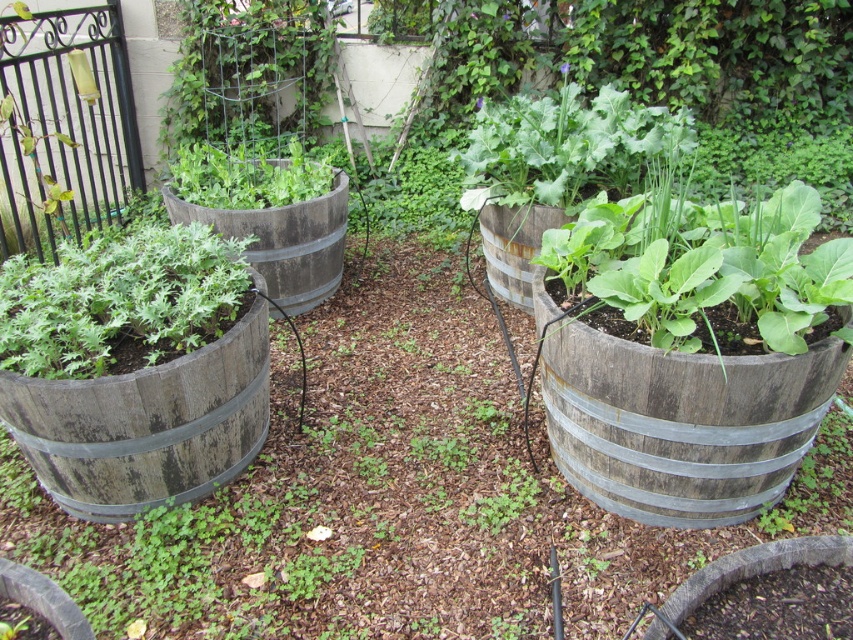
You are standing in the garden and want to take a closeup photo of the green matte barrel at left. Your camera requires you to be at least 2 meters away to avoid distortion. Can you take the photo without moving closer than the required distance?

The distance between the green matte barrel at left and the camera is 1.93 meters, which is less than the required 2 meters. Therefore, you cannot take the photo without moving closer than the required distance.

You are designing a garden layout and need to place a new rectangular planter that is 1 meter wide. You have two existing barrels in the scene, the weathered wood barrel at center and the green matte barrel at left. Based on their widths, which barrel can accommodate the new planter if placed next to it?

The weathered wood barrel at center might be wider than the green matte barrel at left, so the new 1 meter wide planter could fit next to the weathered wood barrel at center if it has sufficient space.

You are standing in the garden and want to place a small statue between the weathered wood barrel at center and the green matte barrel at left. Based on their positions, which barrel should the statue be closer to?

The statue should be placed closer to the green matte barrel at left because the weathered wood barrel at center is positioned to the right of the green matte barrel at left.